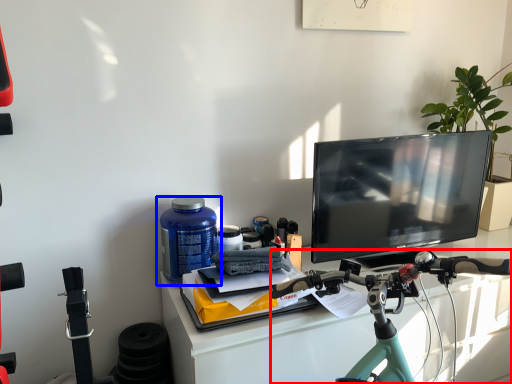
Question: Which point is further to the camera, bicycle (highlighted by a red box) or bottle (highlighted by a blue box)?

Choices:
 (A) bicycle
 (B) bottle

Answer: (B)